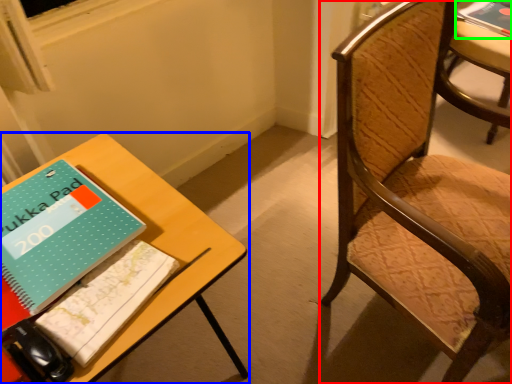
Question: Which object is positioned farthest from chair (highlighted by a red box)? Select from table (highlighted by a blue box) and book (highlighted by a green box).

Choices:
 (A) table
 (B) book

Answer: (B)